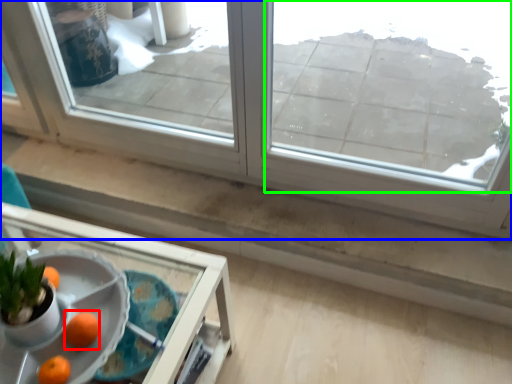
Question: Based on their relative distances, which object is nearer to orange (highlighted by a red box)? Choose from window (highlighted by a blue box) and window (highlighted by a green box).

Choices:
 (A) window
 (B) window

Answer: (A)